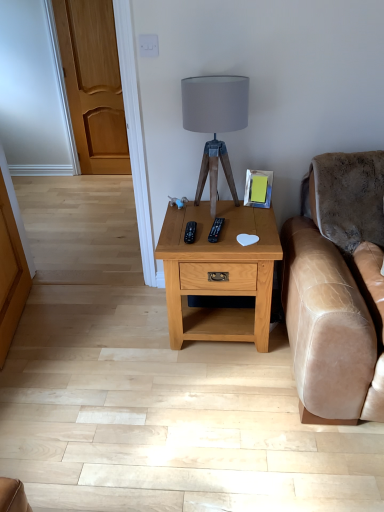
Locate an element on the screen. The image size is (384, 512). vacant position to the left of black plastic remote at center, acting as the first remote starting from the left is located at coordinates [176, 233].